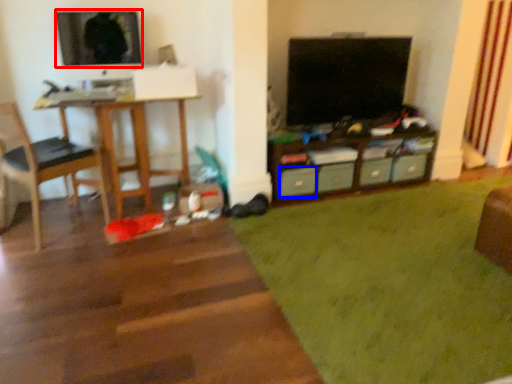
Question: Among these objects, which one is nearest to the camera, television (highlighted by a red box) or drawer (highlighted by a blue box)?

Choices:
 (A) television
 (B) drawer

Answer: (A)